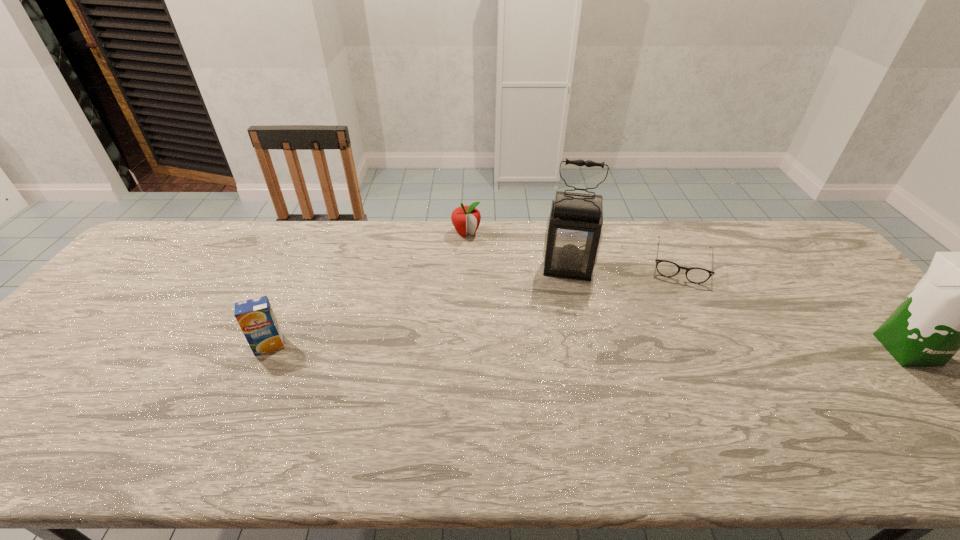
Where is `the fourth closest object to the third object from left to right`? the fourth closest object to the third object from left to right is located at coordinates (256, 318).

Find the location of a particular element. The height and width of the screenshot is (540, 960). vacant space that satisfies the following two spatial constraints: 1. on the back side of the lantern; 2. on the right side of the third tallest object is located at coordinates (305, 268).

Image resolution: width=960 pixels, height=540 pixels. Find the location of `free space that satisfies the following two spatial constraints: 1. on the back side of the shortest object; 2. on the right side of the tallest object`. free space that satisfies the following two spatial constraints: 1. on the back side of the shortest object; 2. on the right side of the tallest object is located at coordinates (566, 262).